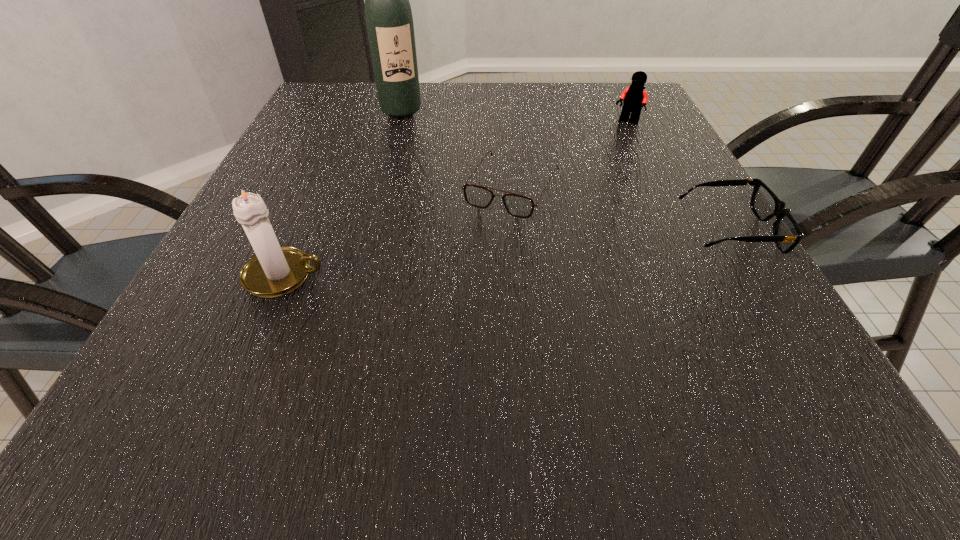
Locate an element on the screen. The image size is (960, 540). sunglasses located in the right edge section of the desktop is located at coordinates (787, 234).

The image size is (960, 540). I want to click on Lego that is at the right edge, so click(x=634, y=96).

Find the location of a particular element. This screenshot has height=540, width=960. object situated at the far right corner is located at coordinates (634, 96).

I want to click on vacant area at the far edge of the desktop, so click(410, 120).

In the image, there is a desktop. Where is `free space at the near edge`? The image size is (960, 540). free space at the near edge is located at coordinates (631, 361).

The image size is (960, 540). Identify the location of vacant area at the left edge. (302, 178).

You are a GUI agent. You are given a task and a screenshot of the screen. Output one action in this format:
    pyautogui.click(x=<x>, y=<y>)
    Task: Click on the vacant space at the right edge of the desktop
    
    Given the screenshot: What is the action you would take?
    click(x=658, y=124)

The height and width of the screenshot is (540, 960). In the image, there is a desktop. Identify the location of vacant space at the near left corner. (226, 367).

This screenshot has height=540, width=960. What are the coordinates of `vacant region between the left sunglasses and the tallest object` in the screenshot? It's located at (457, 150).

Find the location of a particular element. The image size is (960, 540). empty space that is in between the candle holder and the third object from left to right is located at coordinates (398, 232).